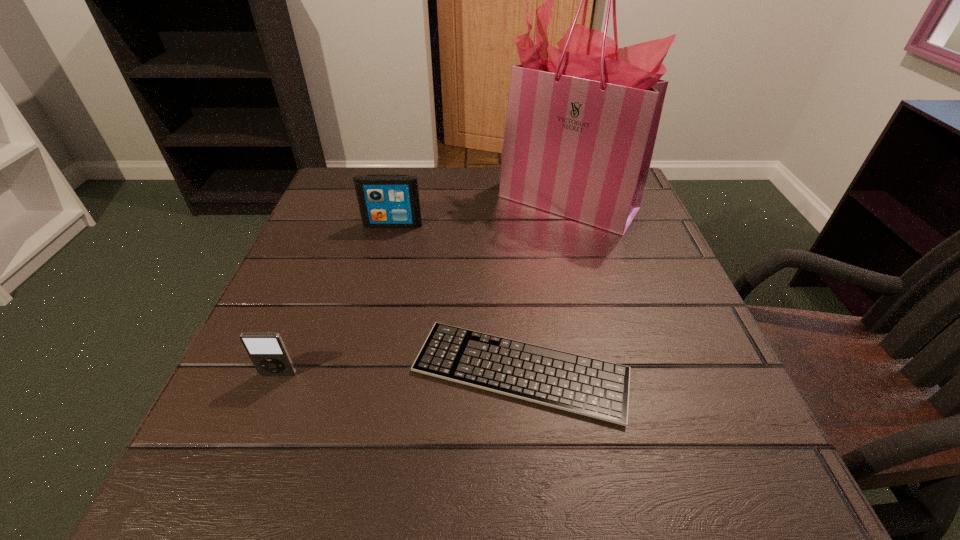
At what (x,y) coordinates should I click in order to perform the action: click on vacant area that lies between the third shortest object and the nearer iPod. Please return your answer as a coordinate pair (x, y). This screenshot has width=960, height=540. Looking at the image, I should click on (336, 299).

The height and width of the screenshot is (540, 960). In order to click on empty location between the left iPod and the shopping bag in this screenshot , I will do `click(423, 288)`.

Locate an element on the screen. unoccupied position between the computer keyboard and the right iPod is located at coordinates (457, 298).

Identify the location of vacant area between the computer keyboard and the second shortest object. (399, 373).

The height and width of the screenshot is (540, 960). Find the location of `free space between the leftmost object and the shopping bag`. free space between the leftmost object and the shopping bag is located at coordinates (x=423, y=288).

I want to click on free space between the second object from left to right and the shopping bag, so click(x=480, y=213).

Find the location of a particular element. This screenshot has width=960, height=540. unoccupied area between the tallest object and the computer keyboard is located at coordinates (544, 286).

I want to click on free space that is in between the third shortest object and the computer keyboard, so click(x=457, y=298).

At what (x,y) coordinates should I click in order to perform the action: click on free space between the computer keyboard and the leftmost object. Please return your answer as a coordinate pair (x, y). This screenshot has height=540, width=960. Looking at the image, I should click on (399, 373).

The height and width of the screenshot is (540, 960). Find the location of `object that can be found as the closest to the shopping bag`. object that can be found as the closest to the shopping bag is located at coordinates (385, 201).